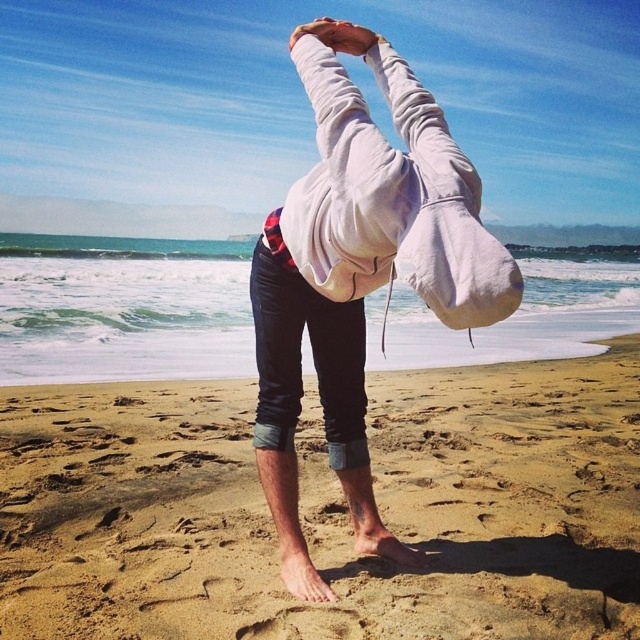
You are a photographer trying to capture the yoga pose clearly. Since the gray fleece hoodie at center and the sandy yellow sand at lower center are both in the frame, which object should be in focus to ensure the subject is sharp?

The gray fleece hoodie at center should be in focus because it is behind the sandy yellow sand at lower center, making it the main subject closer to the camera.

You are a photographer trying to capture the yoga pose from the beach. You notice the sandy yellow sand at lower center and the gray fleece hoodie at center. Which object is closer to the camera based on their positions?

The gray fleece hoodie at center is closer to the camera because it is taller than the sandy yellow sand at lower center, indicating it occupies a more foreground position.

From the picture: You are a photographer trying to capture the yoga pose on the sandy yellow sand at lower center. To ensure the sand is in focus, where should you aim your camera? Please provide coordinates in the format of a point like this example format of point coordinates. The scene is viewed from a standard human perspective.

The sandy yellow sand at lower center is located at point coordinates of (326, 509). Aim your camera at that point to focus on the sand.